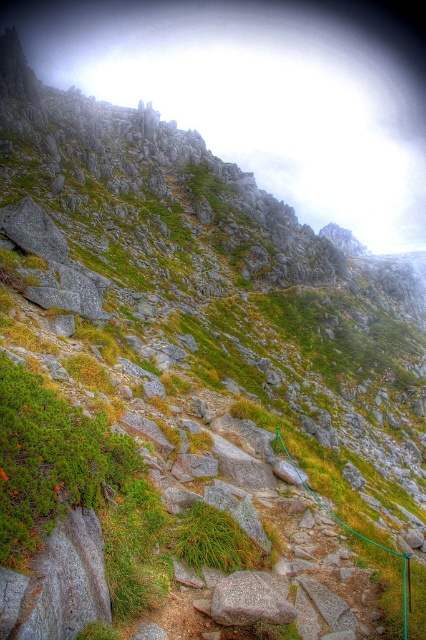
You are a hiker standing on the mountain trail and want to reach the top. You notice two points marked on your map. The first point is at coordinates point (256, 593) and the second is at point (403, 605). Which point is closer to you?

Point (256, 593) is closer to the viewer than point (403, 605), so the first point is closer to you.

You are a hiker carrying a backpack with a 1.2 meter wide tent. You see the granite rock at center and the green rubber rope at center on the mountain trail. Can you place your tent between them without overlapping either object?

The granite rock at center is narrower than the green rubber rope at center, but since the tent is 1.2 meters wide, you need to ensure there is enough space between them. However, the exact distance between the two objects isn